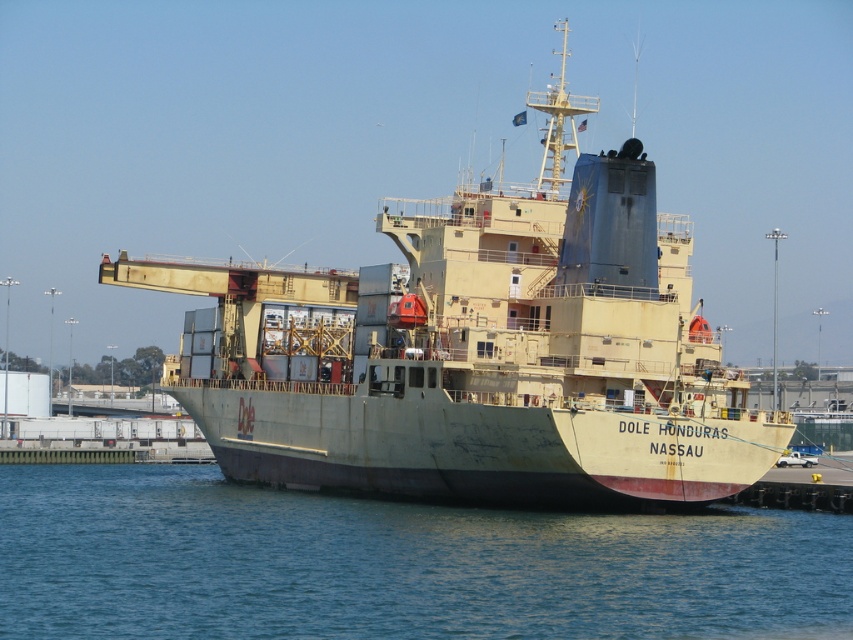
Which of these two, light beige matte ship at center or blue water at lower center, stands shorter?

Standing shorter between the two is blue water at lower center.

From the picture: Can you confirm if light beige matte ship at center is smaller than blue water at lower center?

Incorrect, light beige matte ship at center is not smaller in size than blue water at lower center.

Which is in front, point (300, 413) or point (7, 518)?

Positioned in front is point (7, 518).

Locate an element on the screen. This screenshot has width=853, height=640. light beige matte ship at center is located at coordinates (482, 349).